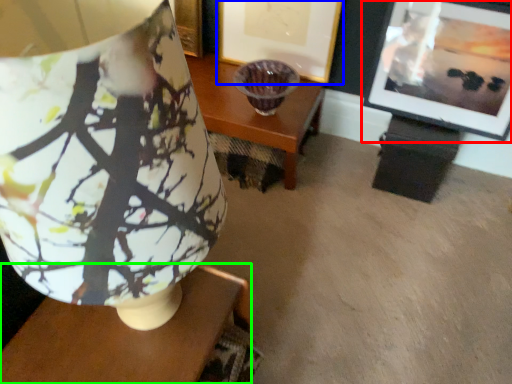
Question: Considering the real-world distances, which object is closest to picture frame (highlighted by a red box)? picture frame (highlighted by a blue box) or table (highlighted by a green box).

Choices:
 (A) picture frame
 (B) table

Answer: (A)